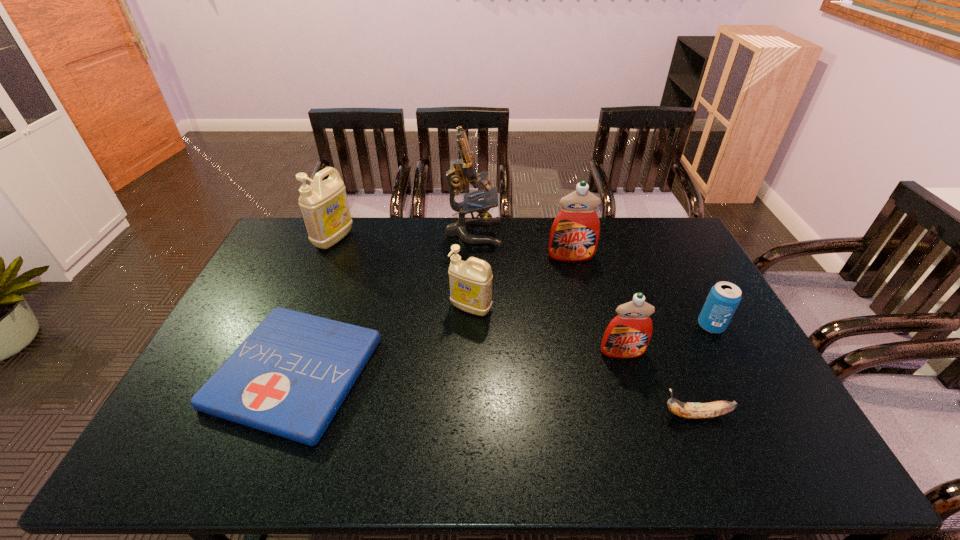
Identify the location of vacant space located at the stem of the banana. The height and width of the screenshot is (540, 960). (505, 415).

Find the location of `vacant space located 0.080m at the stem of the banana`. vacant space located 0.080m at the stem of the banana is located at coordinates (629, 415).

You are a GUI agent. You are given a task and a screenshot of the screen. Output one action in this format:
    pyautogui.click(x=<x>, y=<y>)
    Task: Click on the vacant area located 0.070m on the back of the blue first-aid kit
    
    Given the screenshot: What is the action you would take?
    pyautogui.click(x=324, y=300)

This screenshot has height=540, width=960. In order to click on microscope at the far edge in this screenshot , I will do `click(463, 171)`.

Locate an element on the screen. The height and width of the screenshot is (540, 960). object situated at the near edge is located at coordinates (290, 376).

Identify the location of detergent at the left edge. This screenshot has height=540, width=960. (324, 205).

Where is `the first-aid kit that is at the left edge`? Image resolution: width=960 pixels, height=540 pixels. the first-aid kit that is at the left edge is located at coordinates (290, 376).

Find the location of a particular element. The image size is (960, 540). soda can that is at the right edge is located at coordinates (724, 297).

Where is `banana present at the right edge`? Image resolution: width=960 pixels, height=540 pixels. banana present at the right edge is located at coordinates (710, 409).

Identify the location of object present at the far left corner. (324, 205).